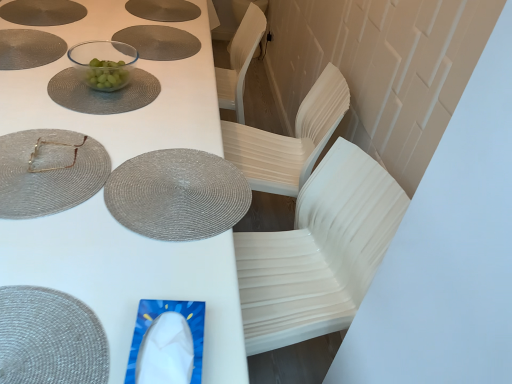
Locate an element on the screen. vacant space underneath matte gray placemat at upper left, the first plate from the left (from a real-world perspective) is located at coordinates (25, 44).